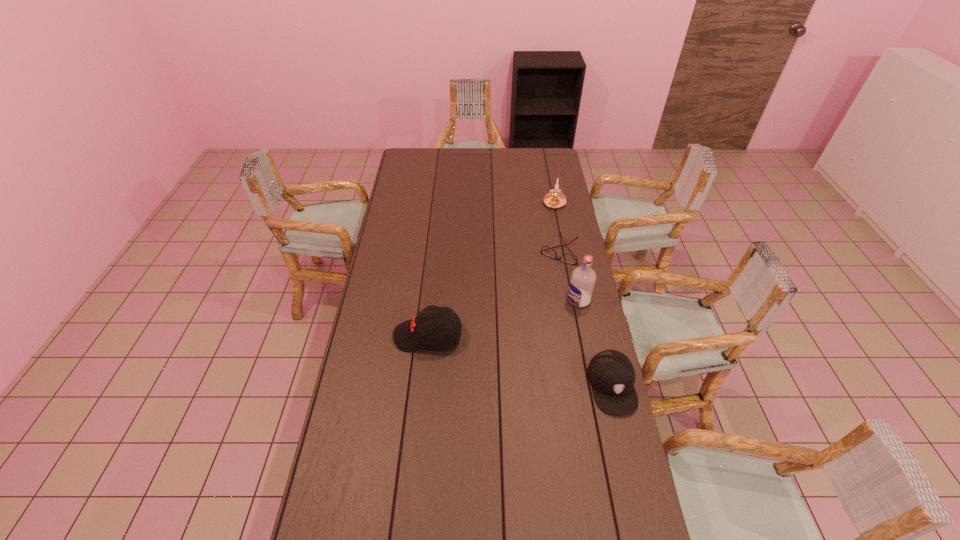
Identify the location of free space located on the front-facing side of the leftmost object. Image resolution: width=960 pixels, height=540 pixels. (368, 336).

Where is `vacant region located on the front-facing side of the leftmost object`? The image size is (960, 540). vacant region located on the front-facing side of the leftmost object is located at coordinates (381, 336).

The height and width of the screenshot is (540, 960). I want to click on free space located 0.160m on the front-facing side of the cap, so click(x=631, y=467).

Find the location of `free spot located 0.150m on the front-facing side of the spectacles`. free spot located 0.150m on the front-facing side of the spectacles is located at coordinates (540, 286).

Find the location of a particular element. This screenshot has width=960, height=540. vacant space located 0.390m on the front-facing side of the spectacles is located at coordinates (515, 326).

Identify the location of free space located 0.150m on the front-facing side of the spectacles. The height and width of the screenshot is (540, 960). (540, 286).

At what (x,y) coordinates should I click in order to perform the action: click on vacant region located 0.110m on the label of the third nearest object. Please return your answer as a coordinate pair (x, y). The width and height of the screenshot is (960, 540). Looking at the image, I should click on (549, 318).

This screenshot has height=540, width=960. I want to click on vacant region located 0.130m on the label of the third nearest object, so click(545, 320).

Identify the location of free space located on the label of the third nearest object. (510, 342).

You are a GUI agent. You are given a task and a screenshot of the screen. Output one action in this format:
    pyautogui.click(x=<x>, y=<y>)
    Task: Click on the vacant space located on the handle side of the candle holder
    
    Given the screenshot: What is the action you would take?
    pyautogui.click(x=540, y=244)